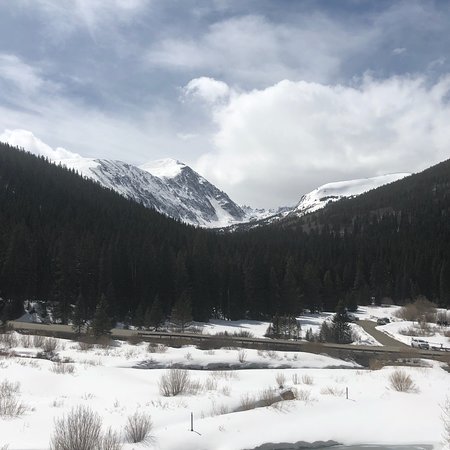
Where is `markers`? The image size is (450, 450). markers is located at coordinates (190, 422), (347, 392).